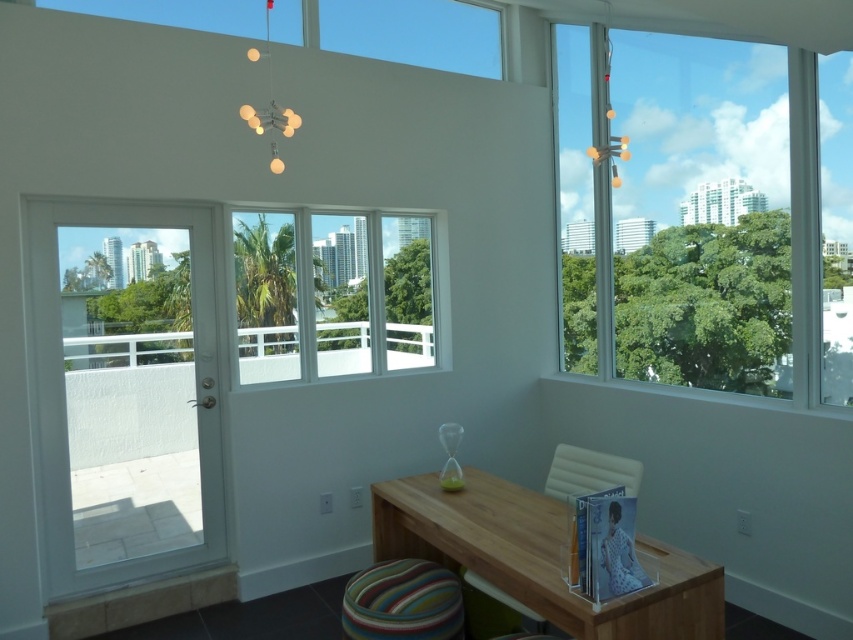
Is transparent glass window at upper right taller than white glass door at left?

Yes, transparent glass window at upper right is taller than white glass door at left.

At what (x,y) coordinates should I click in order to perform the action: click on transparent glass window at upper right. Please return your answer as a coordinate pair (x, y). This screenshot has height=640, width=853. Looking at the image, I should click on [x=680, y=211].

Where is `transparent glass window at upper right`? transparent glass window at upper right is located at coordinates (680, 211).

Is white glass door at left in front of wooden table at center?

No, it is behind wooden table at center.

Does white glass door at left have a greater height compared to wooden table at center?

Yes.

What do you see at coordinates (125, 392) in the screenshot?
I see `white glass door at left` at bounding box center [125, 392].

Locate an element on the screen. The width and height of the screenshot is (853, 640). white glass door at left is located at coordinates (125, 392).

Who is more distant from viewer, (738, 51) or (351, 353)?

The point (351, 353) is more distant.

Is point (772, 289) positioned after point (299, 364)?

No, (772, 289) is in front of (299, 364).

You are a GUI agent. You are given a task and a screenshot of the screen. Output one action in this format:
    pyautogui.click(x=<x>, y=<y>)
    Task: Click on the transparent glass window at upper right
    The height and width of the screenshot is (640, 853).
    Given the screenshot: What is the action you would take?
    pyautogui.click(x=680, y=211)